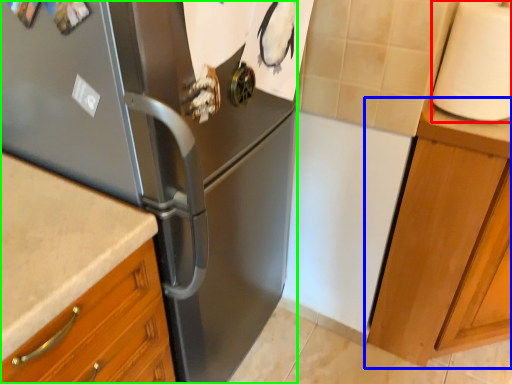
Question: Which object is positioned closest to paper towel (highlighted by a red box)? Select from cabinetry (highlighted by a blue box) and refrigerator (highlighted by a green box).

Choices:
 (A) cabinetry
 (B) refrigerator

Answer: (A)